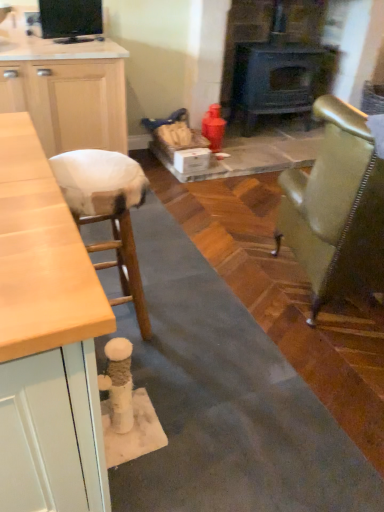
Question: From the image's perspective, is dark gray cast iron wood burning stove at center positioned above or below metallic gold chair at right?

Choices:
 (A) above
 (B) below

Answer: (A)

Question: Choose the correct answer: Is dark gray cast iron wood burning stove at center inside metallic gold chair at right or outside it?

Choices:
 (A) inside
 (B) outside

Answer: (B)

Question: Estimate the real-world distances between objects in this image. Which object is farther from the black glossy tv at upper left?

Choices:
 (A) white fabric stool at left
 (B) dark gray cast iron wood burning stove at center
 (C) metallic gold chair at right

Answer: (C)

Question: Based on their relative distances, which object is farther from the metallic gold chair at right?

Choices:
 (A) dark gray cast iron wood burning stove at center
 (B) black glossy tv at upper left
 (C) white fabric stool at left

Answer: (A)